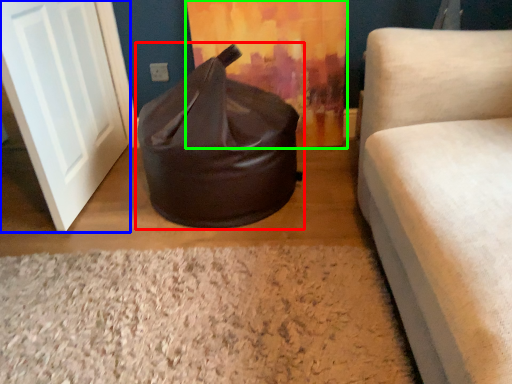
Question: Considering the real-world distances, which object is farthest from bean bag chair (highlighted by a red box)? door (highlighted by a blue box) or curtain (highlighted by a green box)?

Choices:
 (A) door
 (B) curtain

Answer: (A)